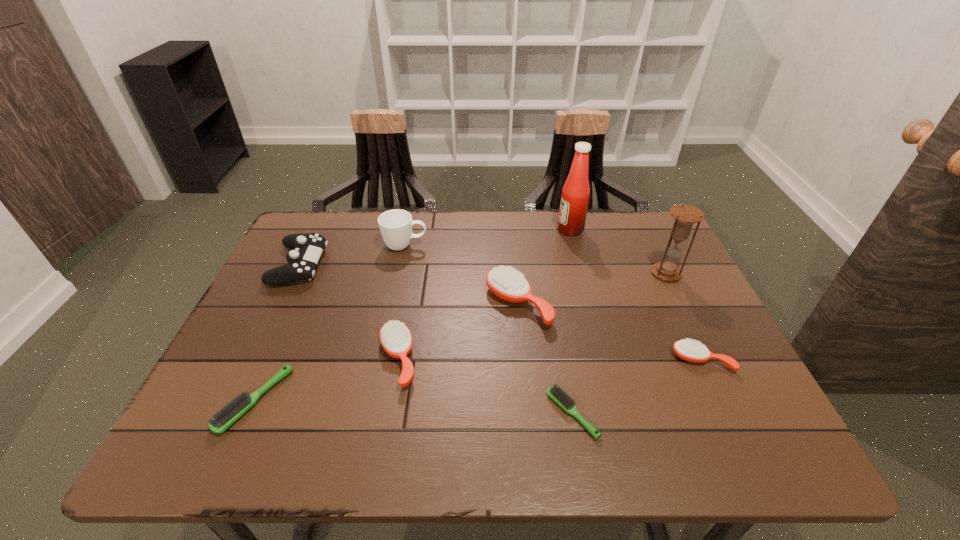
What are the coordinates of `vacant position in the image that satisfies the following two spatial constraints: 1. on the surface of the control; 2. on the right side of the smaller light hairbrush` in the screenshot? It's located at (227, 414).

Where is `free space in the image that satisfies the following two spatial constraints: 1. with the handle on the side of the cup; 2. on the right side of the rightmost hairbrush`? This screenshot has width=960, height=540. free space in the image that satisfies the following two spatial constraints: 1. with the handle on the side of the cup; 2. on the right side of the rightmost hairbrush is located at coordinates click(381, 360).

Identify the location of vacant space that satisfies the following two spatial constraints: 1. on the back side of the rightmost hairbrush; 2. on the front-facing side of the condiment. (639, 230).